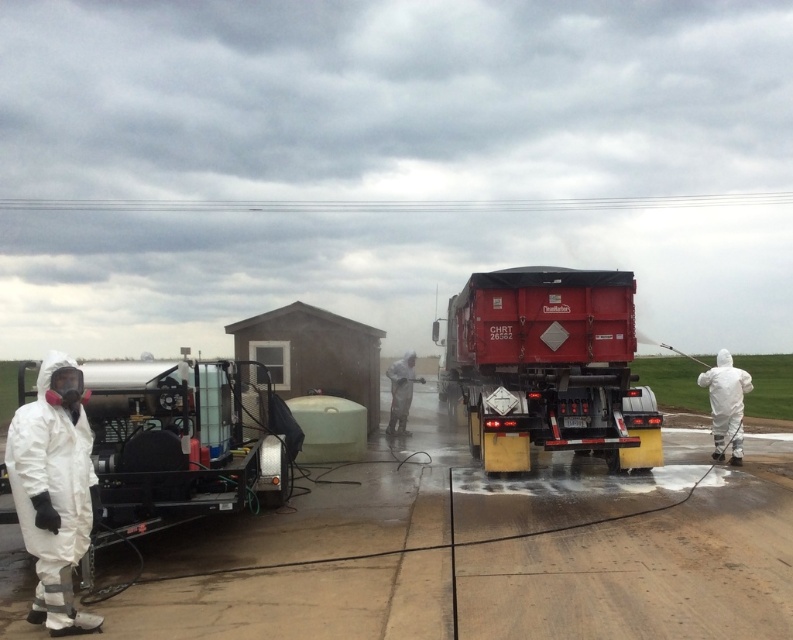
Question: Does smooth concrete tarmac at center have a larger size compared to red matte trailer truck at center?

Choices:
 (A) yes
 (B) no

Answer: (B)

Question: Can you confirm if white matte trailer truck at left is smaller than white matte suit at right?

Choices:
 (A) no
 (B) yes

Answer: (A)

Question: Does smooth concrete tarmac at center appear under red matte trailer truck at center?

Choices:
 (A) no
 (B) yes

Answer: (B)

Question: Which object is farther from the camera taking this photo?

Choices:
 (A) white matte trailer truck at left
 (B) red matte trailer truck at center
 (C) white matte/soft hazmat suit at left

Answer: (B)

Question: Estimate the real-world distances between objects in this image. Which object is closer to the red matte trailer truck at center?

Choices:
 (A) white matte suit at right
 (B) white matte hazmat suit at center

Answer: (A)

Question: Among these objects, which one is farthest from the camera?

Choices:
 (A) white matte trailer truck at left
 (B) white matte hazmat suit at center
 (C) red matte trailer truck at center

Answer: (B)